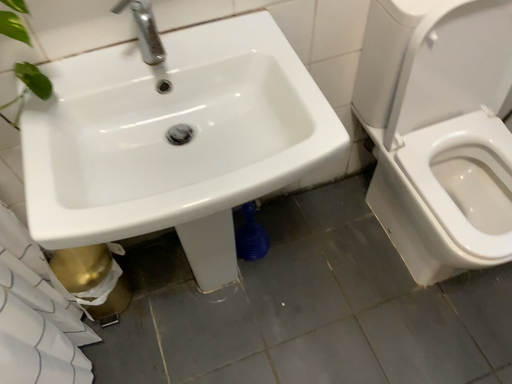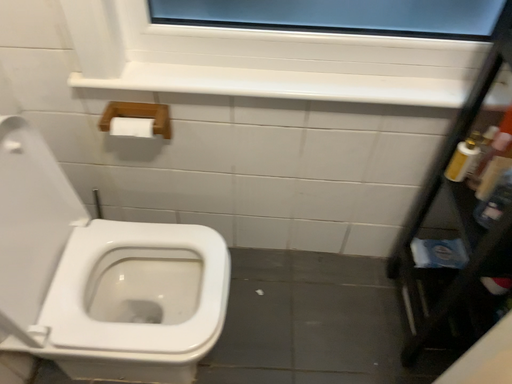
Question: How did the camera likely rotate when shooting the video?

Choices:
 (A) rotated upward
 (B) rotated downward

Answer: (A)